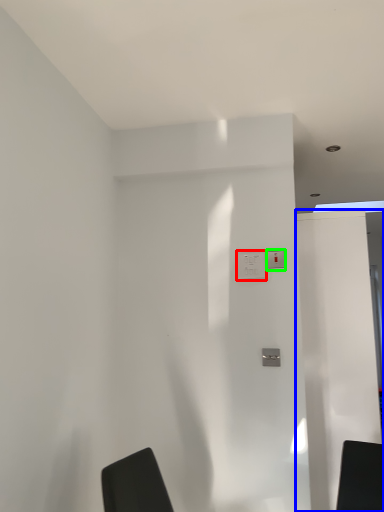
Question: Which object is positioned farthest from electric outlet (highlighted by a red box)? Select from screen door (highlighted by a blue box) and light switch (highlighted by a green box).

Choices:
 (A) screen door
 (B) light switch

Answer: (A)